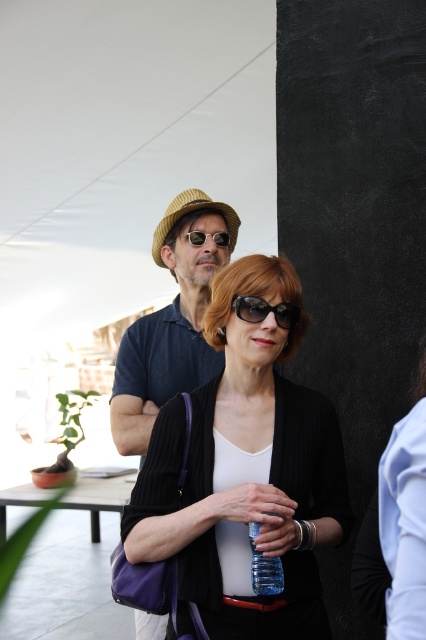
Question: Is matte blue shirt at center closer to the viewer compared to blue plastic bottle at center?

Choices:
 (A) no
 (B) yes

Answer: (A)

Question: Which point is farther from the camera taking this photo?

Choices:
 (A) (204, 241)
 (B) (282, 305)
 (C) (273, 592)

Answer: (A)

Question: Is matte blue shirt at center to the right of black plastic sunglasses at center from the viewer's perspective?

Choices:
 (A) yes
 (B) no

Answer: (B)

Question: Does black matte cardigan at center have a lesser width compared to black plastic sunglasses at center?

Choices:
 (A) yes
 (B) no

Answer: (B)

Question: Among these points, which one is farthest from the camera?

Choices:
 (A) (261, 317)
 (B) (192, 230)

Answer: (B)

Question: Which of these objects is positioned farthest from the blue plastic bottle at center?

Choices:
 (A) sunglasses at center
 (B) black plastic sunglasses at center
 (C) matte blue shirt at center
 (D) black matte cardigan at center

Answer: (A)